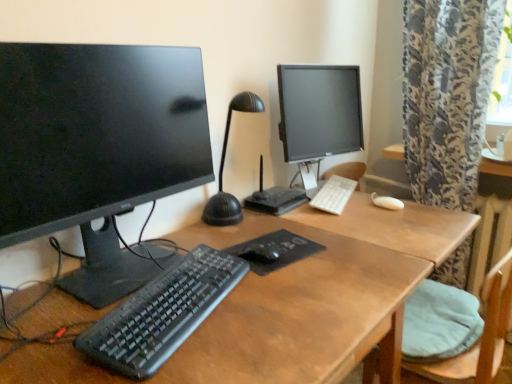
Locate an element on the screen. free space between black plastic keyboard at center, the first computer keyboard positioned from the bottom, and black textured mousepad at center is located at coordinates (245, 294).